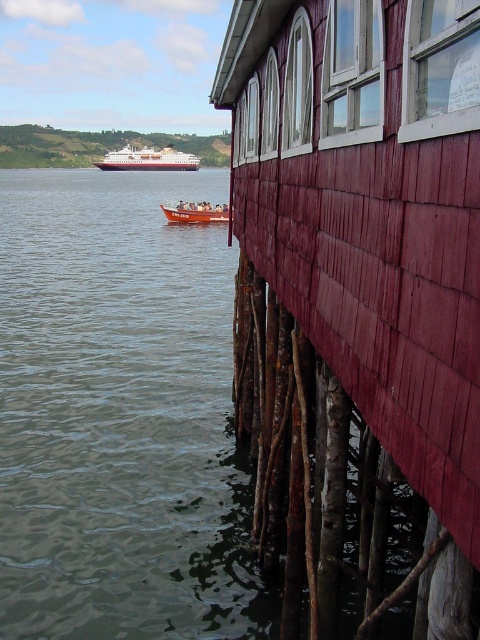
You are standing at the water edge and want to take a photo of the wooden shingles hut at right. If your camera can focus on objects within 2 meters, will you need to move closer or farther away to capture it clearly?

The wooden shingles hut at right is 2.33 meters from the camera, which is slightly beyond the 2 meter focus range. To capture it clearly, you need to move closer to reduce the distance.

You are standing at point [371,211] in the image. What object are you directly facing?

You are directly facing the wooden shingles hut at right.